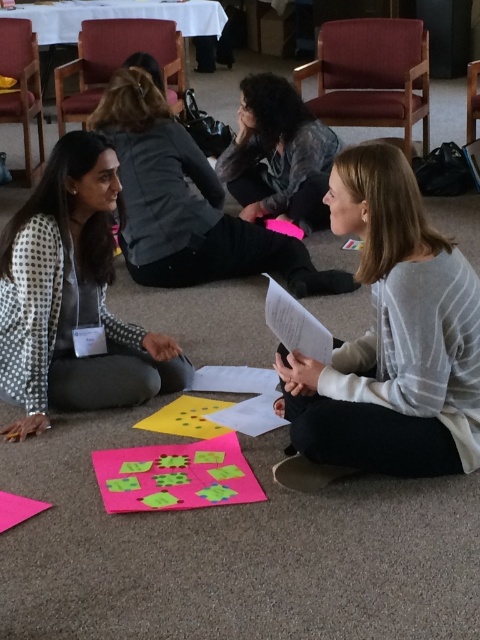
From the picture: Who is shorter, white dotted blazer at left or dark gray sweater at center?

dark gray sweater at center is shorter.

Which is below, white dotted blazer at left or dark gray sweater at center?

white dotted blazer at left

Does point (107, 202) lie behind point (297, 104)?

No.

Image resolution: width=480 pixels, height=640 pixels. Find the location of `white dotted blazer at left`. white dotted blazer at left is located at coordinates (72, 298).

Between gray striped sweater at center and white dotted blazer at left, which one appears on the right side from the viewer's perspective?

gray striped sweater at center is more to the right.

Is point (315, 468) farther from camera compared to point (69, 214)?

No, it is in front of (69, 214).

Does point (311, 444) come farther from viewer compared to point (48, 385)?

No, it is not.

Find the location of a particular element. gray striped sweater at center is located at coordinates (388, 342).

Is gray striped sweater at center positioned at the back of dark gray sweater at center?

Answer: No, gray striped sweater at center is closer to the viewer.

How much distance is there between gray striped sweater at center and dark gray sweater at center?

gray striped sweater at center and dark gray sweater at center are 2.05 meters apart.

This screenshot has width=480, height=640. What do you see at coordinates (388, 342) in the screenshot?
I see `gray striped sweater at center` at bounding box center [388, 342].

Locate an element on the screen. The image size is (480, 640). gray striped sweater at center is located at coordinates (388, 342).